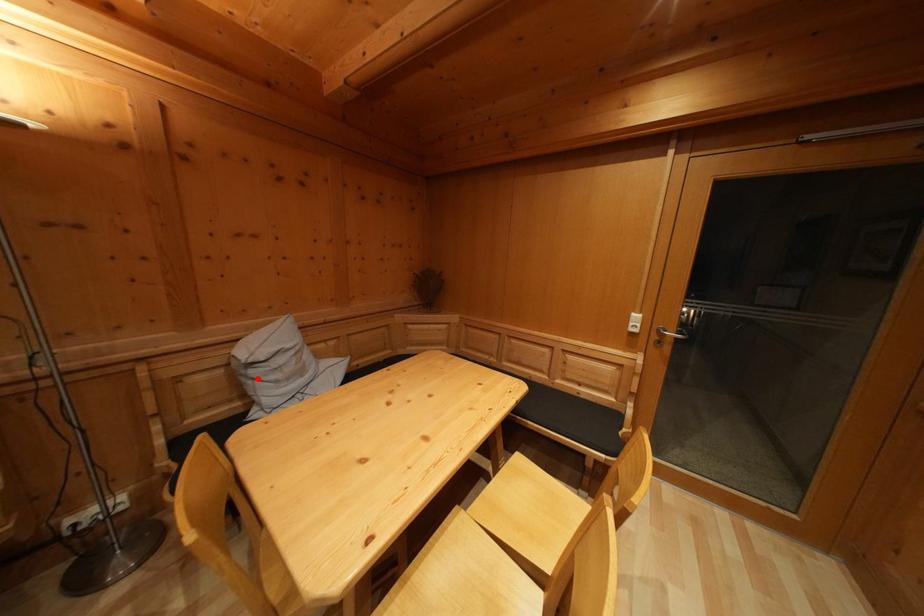
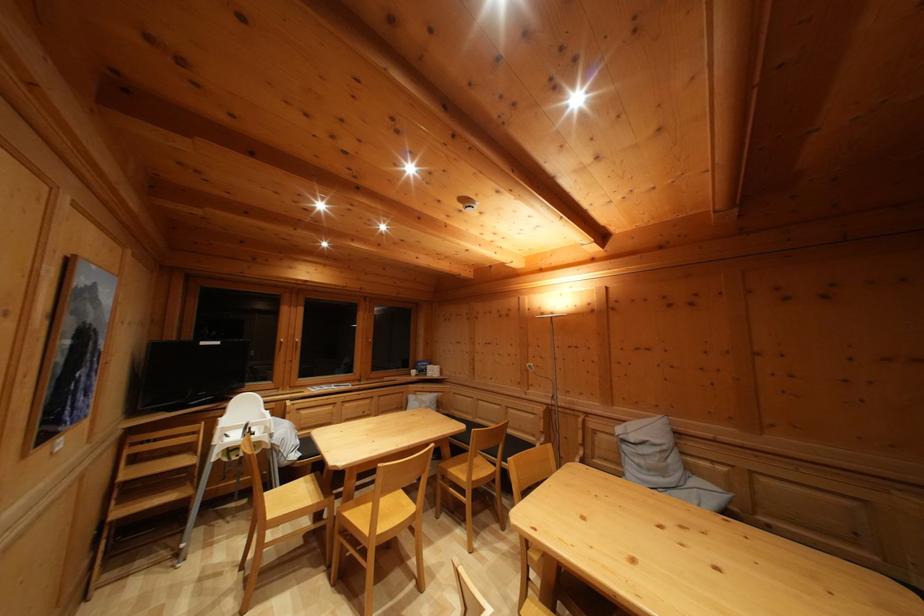
In the second image, find the point that corresponds to the highlighted location in the first image.

(629, 454)